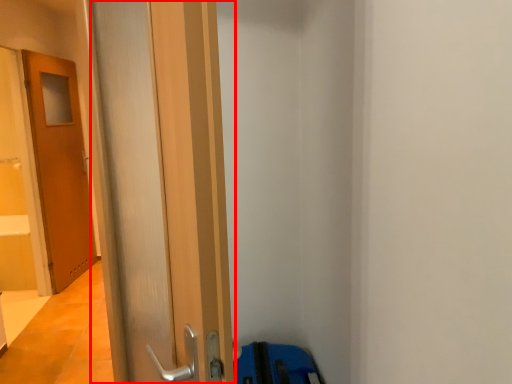
Question: Where is door (annotated by the red box) located in relation to door in the image?

Choices:
 (A) left
 (B) right

Answer: (B)